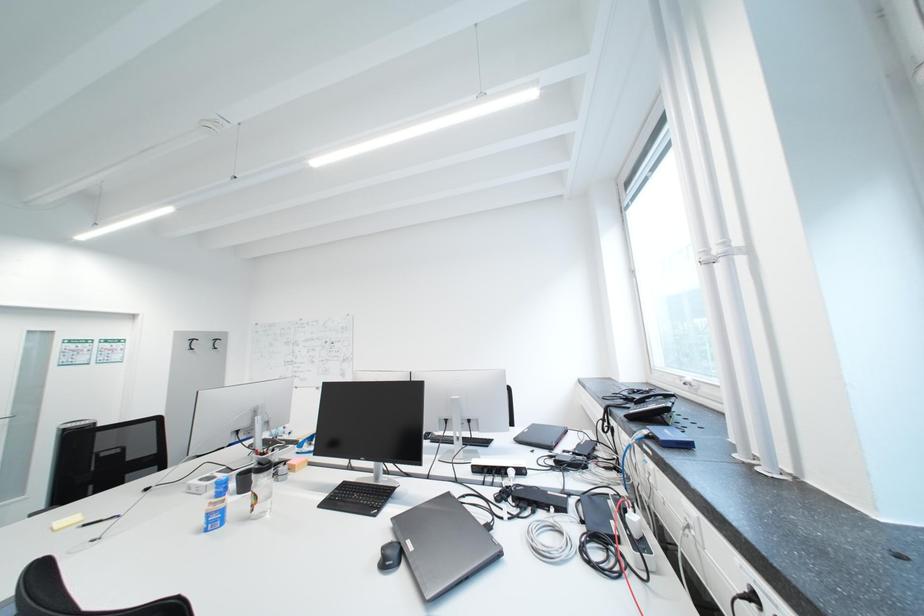
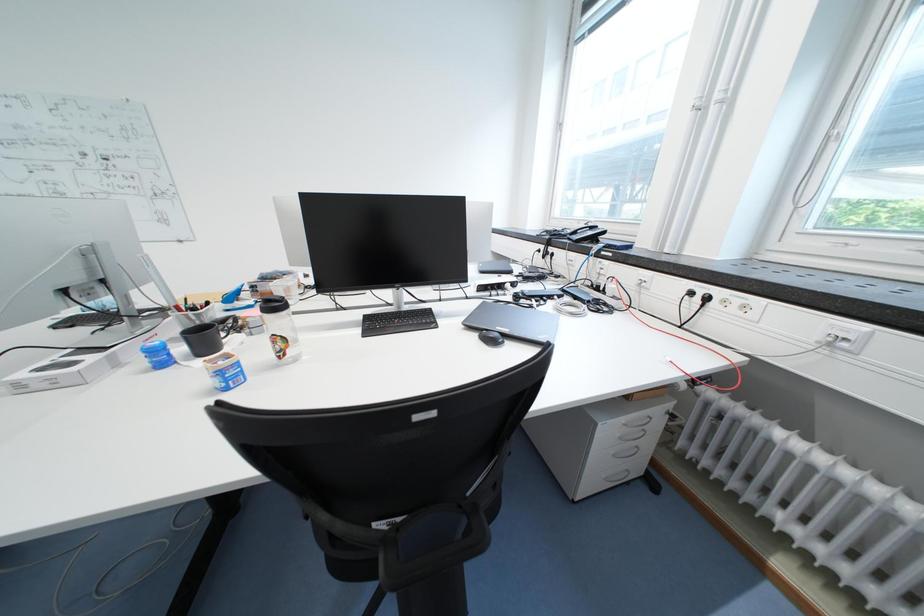
The images are taken continuously from a first-person perspective. In which direction is your viewpoint rotating?

The camera rotated toward right-down.